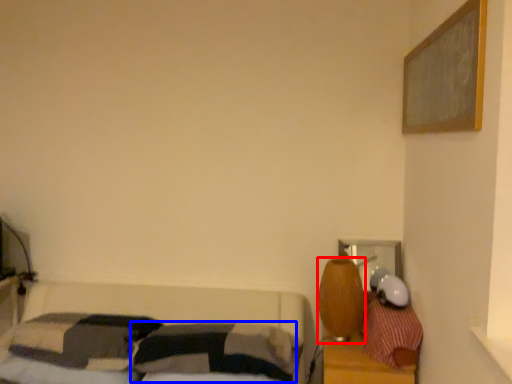
Question: Among these objects, which one is nearest to the camera, table lamp (highlighted by a red box) or pillow (highlighted by a blue box)?

Choices:
 (A) table lamp
 (B) pillow

Answer: (B)